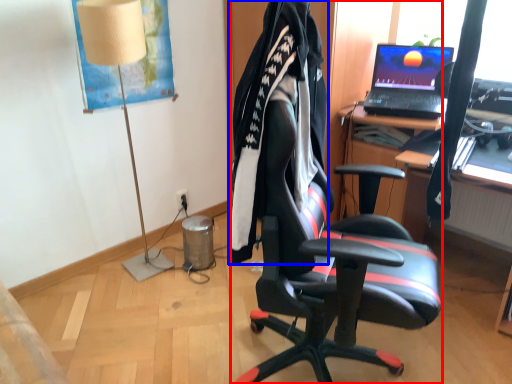
Question: Among these objects, which one is farthest to the camera, chair (highlighted by a red box) or clothing (highlighted by a blue box)?

Choices:
 (A) chair
 (B) clothing

Answer: (B)